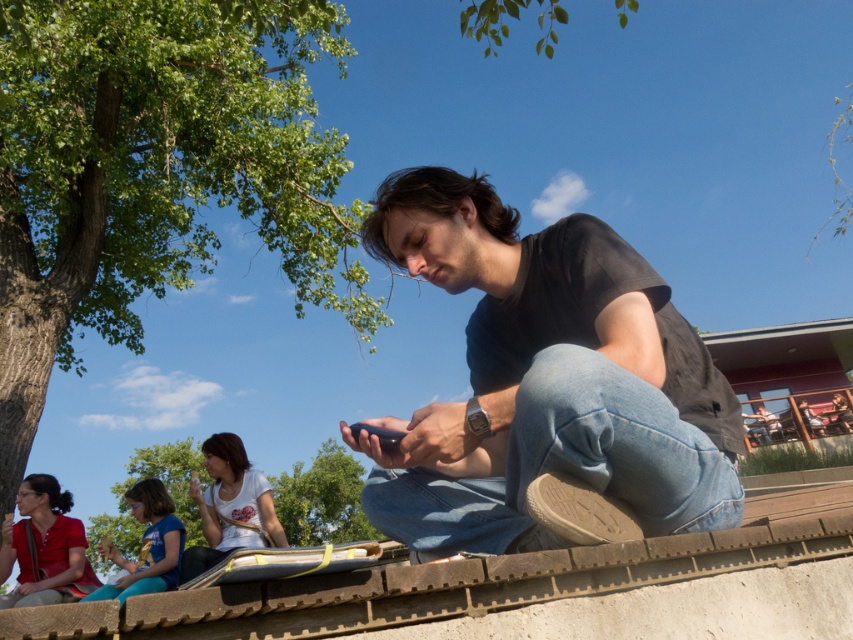
You are standing in the outdoor scene and want to take a photo of the white matte shirt at lower left without including the green leafy tree at upper left in the frame. Which direction should you move to achieve this?

Move to the right so that the white matte shirt at lower left is framed without the green leafy tree at upper left, which is positioned to its left.

You are a photographer trying to capture a candid shot of the black matte shirt at center and the light brown hair at lower left. Since you want to ensure both subjects are in focus, you need to know their vertical positioning. Which object is higher in the frame?

The black matte shirt at center is above light brown hair at lower left, so it is higher in the frame.

You are a photographer trying to capture a photo of both the black matte shirt at center and the light brown hair at lower left. Which object should you focus on first to ensure both are in sharp focus?

You should focus on the black matte shirt at center first because it is closer to you than the light brown hair at lower left, ensuring both will be in focus when using a camera with a shallow depth of field.